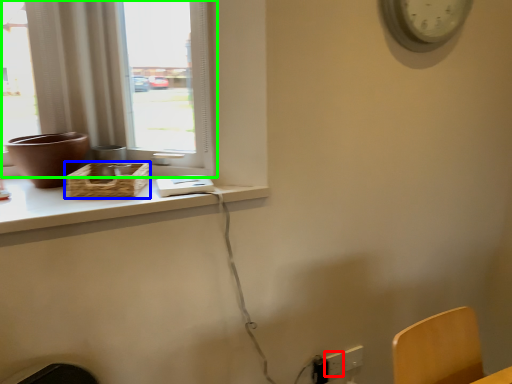
Question: Based on their relative distances, which object is nearer to electric outlet (highlighted by a red box)? Choose from basket (highlighted by a blue box) and window (highlighted by a green box).

Choices:
 (A) basket
 (B) window

Answer: (A)